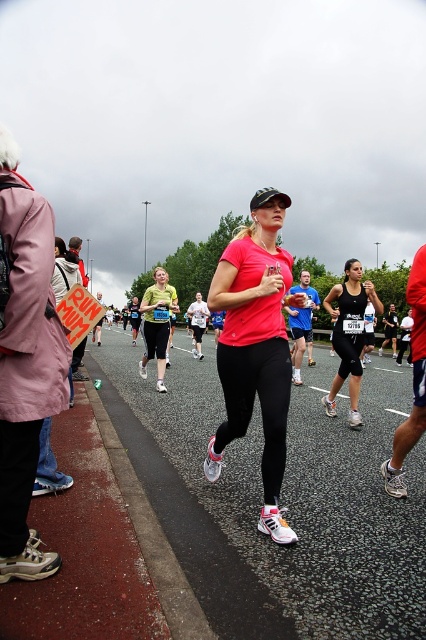
You are a photographer at the marathon event. You want to capture a photo where both the black matte tank top at center and the matte green tank top at center are visible. Based on their positions, which one should you focus on first to ensure both are in the frame?

The black matte tank top at center is below the matte green tank top at center, so you should focus on the matte green tank top at center first to ensure both are in the frame.

You are a photographer at the marathon event. You want to capture a photo that includes both the matte pink shirt at center and the matte green tank top at center. Which one should you focus on first to ensure both are in the frame?

The matte pink shirt at center is positioned under the matte green tank top at center, so focusing on the matte green tank top at center first will allow you to include both in the frame.

You are a photographer at the marathon event. You want to take a photo that includes both the matte green tank top at center and the wooden signboard at left. Which object should you focus on first to ensure both are in frame?

Since the matte green tank top at center is smaller in size compared to the wooden signboard at left, you should focus on the matte green tank top at center first to ensure both fit within the frame.